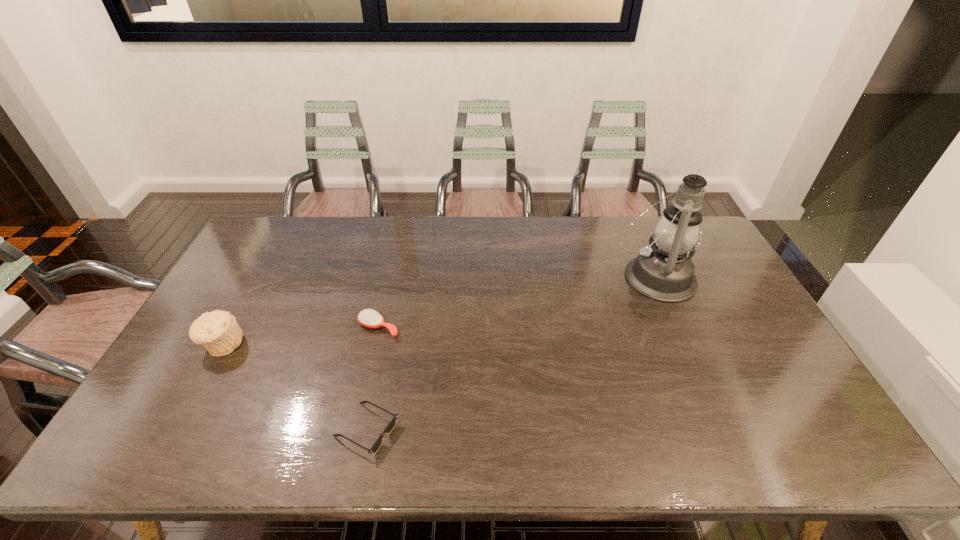
Image resolution: width=960 pixels, height=540 pixels. Find the location of `oil lamp`. oil lamp is located at coordinates (664, 271).

Locate an element on the screen. the tallest object is located at coordinates (664, 271).

Find the location of a particular element. The width and height of the screenshot is (960, 540). muffin is located at coordinates (218, 331).

Where is `the third shortest object`? the third shortest object is located at coordinates (218, 331).

Identify the location of hairbrush. (369, 318).

Where is `sunglasses`? This screenshot has height=540, width=960. sunglasses is located at coordinates (391, 425).

Where is `the nearest object`? the nearest object is located at coordinates click(391, 425).

Locate an element on the screen. This screenshot has width=960, height=540. blank space located on the front of the oil lamp is located at coordinates (698, 379).

Where is `blank space located on the right of the third shortest object`? Image resolution: width=960 pixels, height=540 pixels. blank space located on the right of the third shortest object is located at coordinates (265, 345).

You are a GUI agent. You are given a task and a screenshot of the screen. Output one action in this format:
    pyautogui.click(x=<x>, y=<y>)
    Task: Click on the vacant space situated 0.290m on the back of the hairbrush
    This screenshot has height=540, width=960.
    Given the screenshot: What is the action you would take?
    pyautogui.click(x=395, y=255)